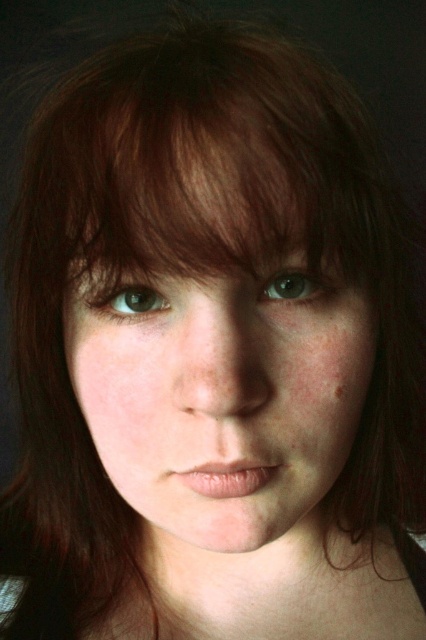
Question: Which point is closer to the camera?

Choices:
 (A) brown matte eye at center
 (B) green matte eye at center
 (C) brown matte freckle at lower right

Answer: (B)

Question: Which is farther from the green matte eye at center?

Choices:
 (A) brown matte freckle at lower right
 (B) brown matte eye at center

Answer: (B)

Question: Does brown matte eye at center appear on the left side of brown matte freckle at lower right?

Choices:
 (A) no
 (B) yes

Answer: (B)

Question: Does green matte eye at center have a larger size compared to brown matte freckle at lower right?

Choices:
 (A) yes
 (B) no

Answer: (A)

Question: Which object is positioned farthest from the brown matte freckle at lower right?

Choices:
 (A) green matte eye at center
 (B) brown matte eye at center

Answer: (B)

Question: From the image, what is the correct spatial relationship of green matte eye at center in relation to brown matte eye at center?

Choices:
 (A) right
 (B) left

Answer: (A)